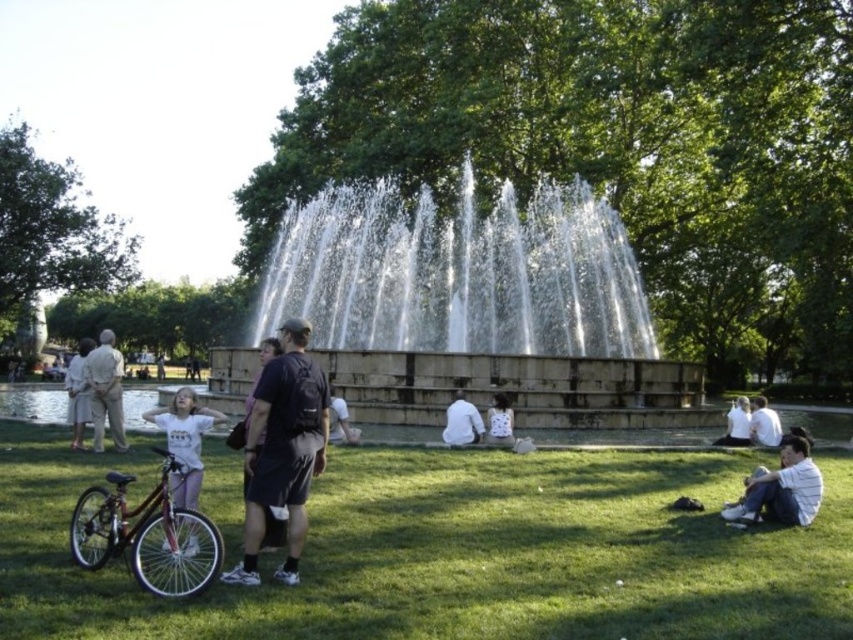
Between green grass at lower center and black fabric backpack at center, which one is positioned lower?

Positioned lower is green grass at lower center.

Between point (631, 612) and point (323, 396), which one is positioned in front?

Positioned in front is point (631, 612).

I want to click on green grass at lower center, so click(x=454, y=552).

Is shiny metallic bicycle at lower left in front of dark gray shirt at left?

Yes, it is.

Is point (82, 547) positioned after point (93, 404)?

No, it is in front of (93, 404).

You are a GUI agent. You are given a task and a screenshot of the screen. Output one action in this format:
    pyautogui.click(x=<x>, y=<y>)
    Task: Click on the shiny metallic bicycle at lower left
    The image size is (853, 640).
    Given the screenshot: What is the action you would take?
    pyautogui.click(x=146, y=534)

Which of these two, white stone fountain at center or white cotton shirt at center, stands shorter?

white cotton shirt at center is shorter.

Who is more forward, [322,276] or [445,428]?

Point [445,428]

At what (x,y) coordinates should I click in order to perform the action: click on white stone fountain at center. Please return your answer as a coordinate pair (x, y). The width and height of the screenshot is (853, 640). Looking at the image, I should click on (477, 307).